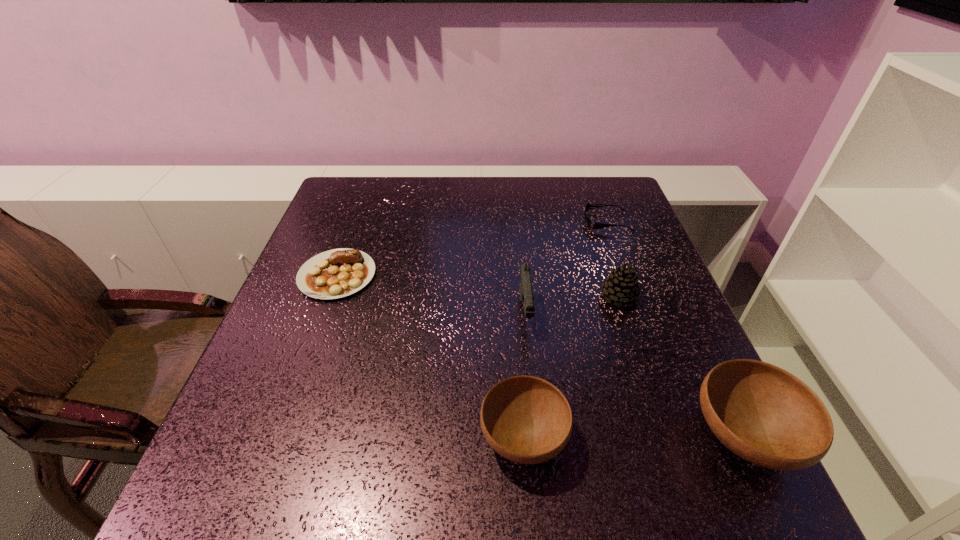
Please point a spot to add another bowl on the left. Please provide its 2D coordinates. Your answer should be formatted as a tuple, i.e. [(x, y)], where the tuple contains the x and y coordinates of a point satisfying the conditions above.

[(303, 439)]